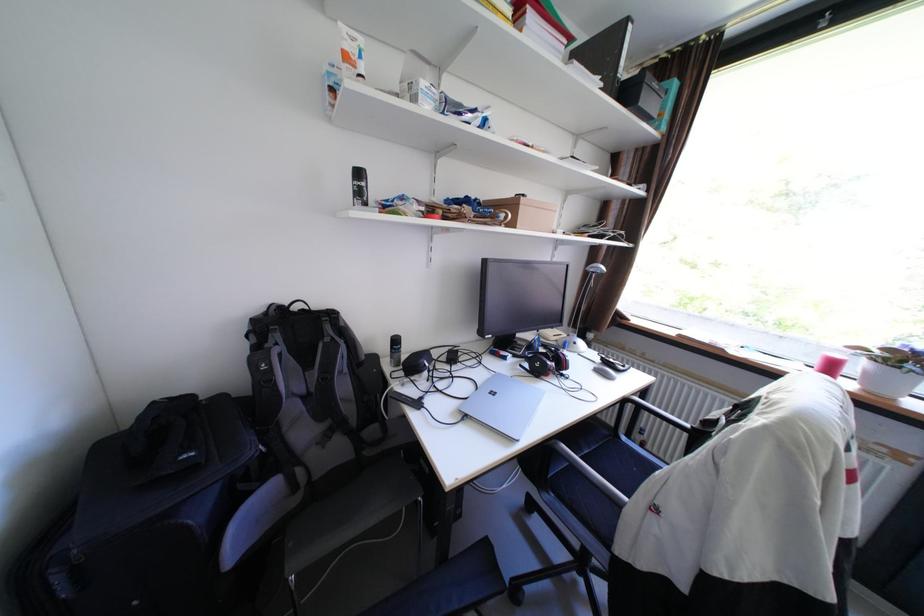
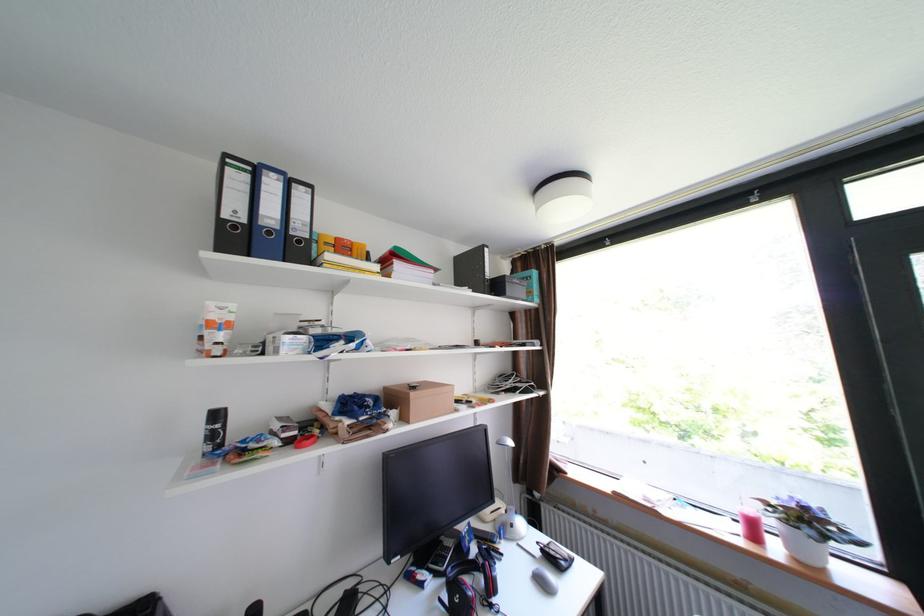
Where in the second image is the point corresponding to [371,195] from the first image?

(225, 436)